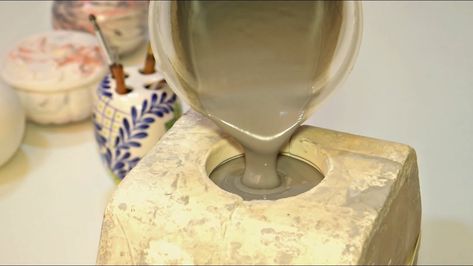
Image resolution: width=473 pixels, height=266 pixels. I want to click on plastic cup, so click(x=342, y=65).